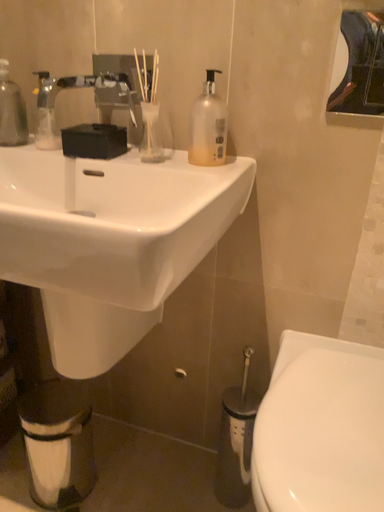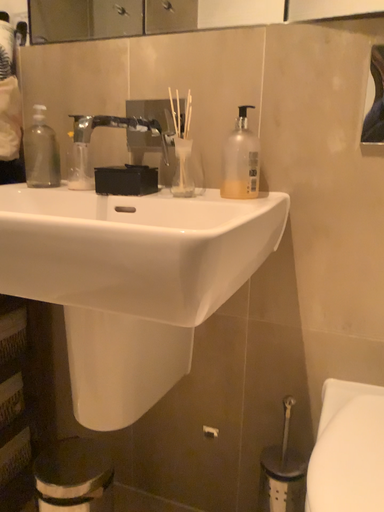
Question: Which way did the camera rotate in the video?

Choices:
 (A) rotated downward
 (B) rotated upward

Answer: (B)